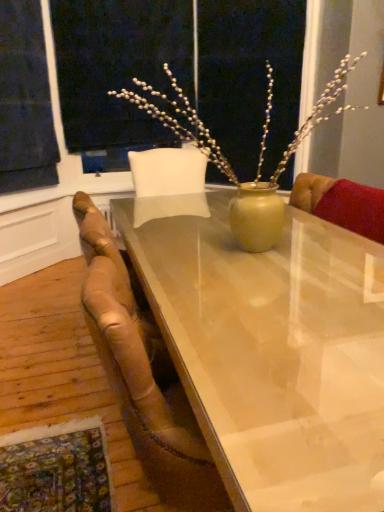
Question: Would you say dark blue fabric at upper left is a long distance from translucent glass table at center?

Choices:
 (A) yes
 (B) no

Answer: (A)

Question: Is dark blue fabric at upper left shorter than translucent glass table at center?

Choices:
 (A) yes
 (B) no

Answer: (B)

Question: From the image's perspective, does dark blue fabric at upper left appear higher than translucent glass table at center?

Choices:
 (A) no
 (B) yes

Answer: (B)

Question: Considering the relative positions of dark blue fabric at upper left and translucent glass table at center in the image provided, is dark blue fabric at upper left to the right of translucent glass table at center from the viewer's perspective?

Choices:
 (A) yes
 (B) no

Answer: (B)

Question: Is dark blue fabric at upper left facing away from translucent glass table at center?

Choices:
 (A) yes
 (B) no

Answer: (B)

Question: From a real-world perspective, is dark blue fabric at upper left on top of translucent glass table at center?

Choices:
 (A) no
 (B) yes

Answer: (B)

Question: Considering the relative sizes of leather at left and dark blue fabric at upper left in the image provided, is leather at left bigger than dark blue fabric at upper left?

Choices:
 (A) no
 (B) yes

Answer: (B)

Question: Is leather at left positioned behind dark blue fabric at upper left?

Choices:
 (A) no
 (B) yes

Answer: (A)

Question: Is dark blue fabric at upper left at the back of leather at left?

Choices:
 (A) yes
 (B) no

Answer: (B)

Question: From the image's perspective, is leather at left located beneath dark blue fabric at upper left?

Choices:
 (A) yes
 (B) no

Answer: (A)

Question: From a real-world perspective, is leather at left below dark blue fabric at upper left?

Choices:
 (A) yes
 (B) no

Answer: (A)

Question: Considering the relative sizes of leather at left and dark blue fabric at upper left in the image provided, is leather at left smaller than dark blue fabric at upper left?

Choices:
 (A) no
 (B) yes

Answer: (A)

Question: Would you consider dark blue fabric at upper left to be distant from leather at left?

Choices:
 (A) yes
 (B) no

Answer: (A)